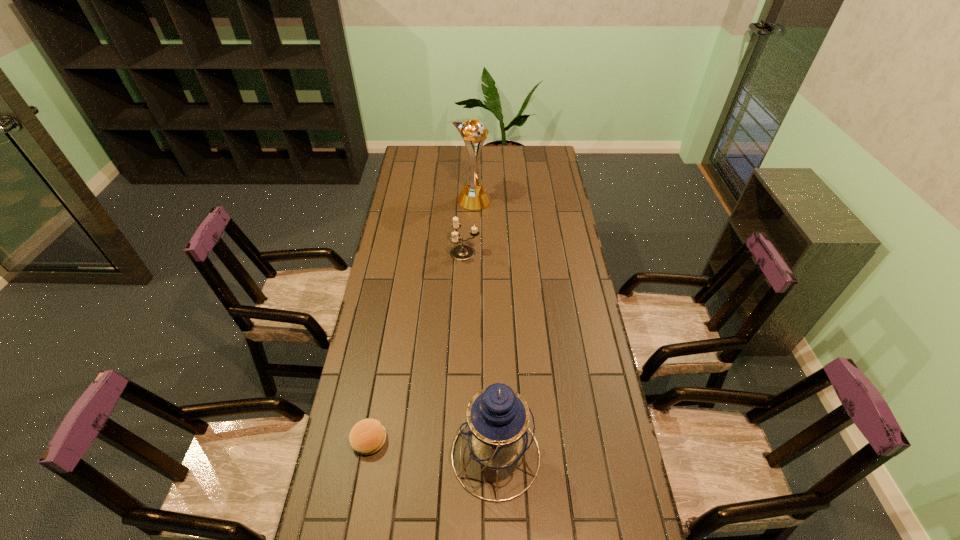
You are a GUI agent. You are given a task and a screenshot of the screen. Output one action in this format:
    pyautogui.click(x=<x>, y=<y>)
    Task: Click on the free space located 0.170m on the left of the third nearest object
    
    Given the screenshot: What is the action you would take?
    pyautogui.click(x=408, y=253)

The height and width of the screenshot is (540, 960). In order to click on free space located 0.240m on the back of the shortest object in this screenshot , I will do `click(384, 355)`.

Image resolution: width=960 pixels, height=540 pixels. In order to click on object that is at the left edge in this screenshot , I will do `click(368, 436)`.

Where is `vacant space at the far edge of the desktop`? Image resolution: width=960 pixels, height=540 pixels. vacant space at the far edge of the desktop is located at coordinates (497, 150).

You are a GUI agent. You are given a task and a screenshot of the screen. Output one action in this format:
    pyautogui.click(x=<x>, y=<y>)
    Task: Click on the blank space at the left edge of the desktop
    The image size is (960, 540).
    Given the screenshot: What is the action you would take?
    pyautogui.click(x=399, y=191)

Identify the location of vacant space at the right edge of the desktop. (559, 198).

Image resolution: width=960 pixels, height=540 pixels. I want to click on unoccupied position between the patty and the farthest object, so click(x=421, y=320).

In order to click on unoccupied area between the shortest object and the trophy in this screenshot , I will do `click(421, 320)`.

Find the location of a particular element. free space between the candle holder and the trophy is located at coordinates (468, 227).

Locate an element on the screen. The width and height of the screenshot is (960, 540). vacant space that's between the third shortest object and the third tallest object is located at coordinates (480, 354).